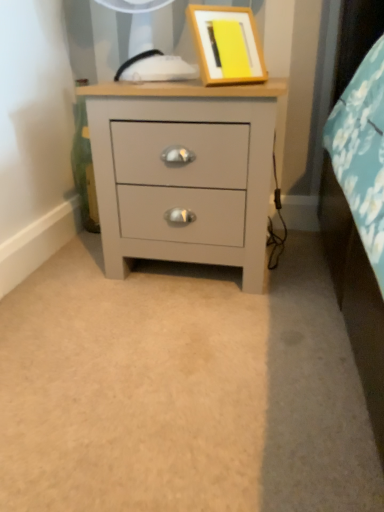
The height and width of the screenshot is (512, 384). What are the coordinates of `vacant area in front of matte gray chest of drawers at center` in the screenshot? It's located at (196, 337).